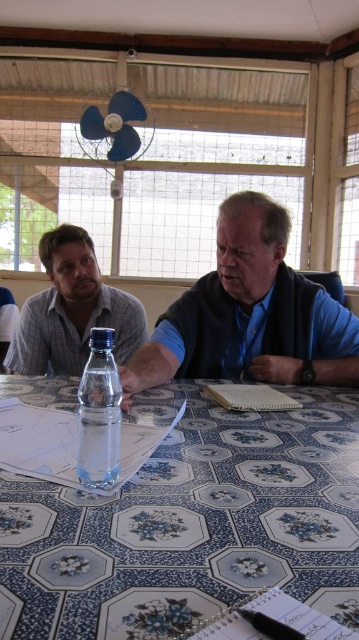
You are a photographer taking a picture of the scene. To ensure both the matte gray shirt at left and the clear plastic bottle at center are in focus, where should you position your camera relative to the two objects?

Position the camera so it faces the clear plastic bottle at center and the matte gray shirt at left, ensuring both are within the camera frame. Since the matte gray shirt at left is to the left of the clear plastic bottle at center, aligning the camera to capture both their positions will keep them in focus.

Consider the image. You are a photographer trying to capture a candid shot of the matte gray shirt at left and the blue matte fan at upper center. Considering their heights, which object should you focus on first to ensure both are in frame?

The matte gray shirt at left is much taller than the blue matte fan at upper center, so you should focus on the matte gray shirt at left first to ensure both are in frame.

You are organizing a small meeting in this room and need to place a new item on the table. The item is the same size as the clear plastic bottle at center. Which object on the table can you replace to make space without moving the matte gray shirt at left?

You can replace the clear plastic bottle at center with the new item since it is smaller than the matte gray shirt at left, allowing space for the new item without moving the matte gray shirt at left.